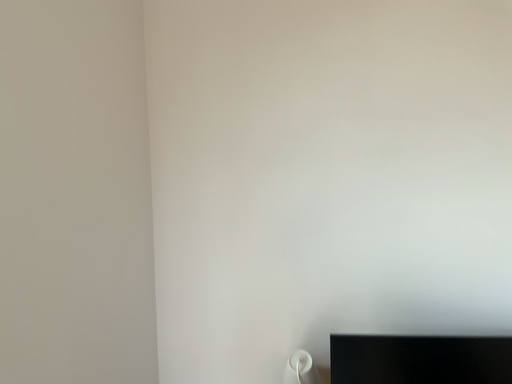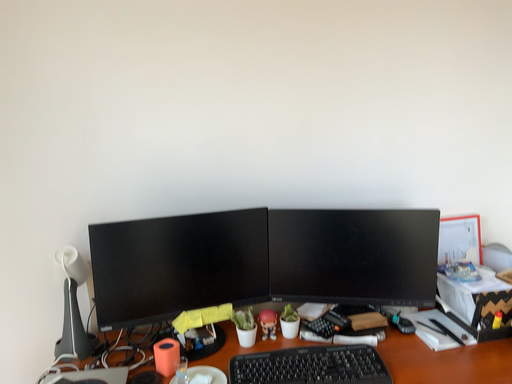
Question: How did the camera likely rotate when shooting the video?

Choices:
 (A) rotated right
 (B) rotated left

Answer: (A)